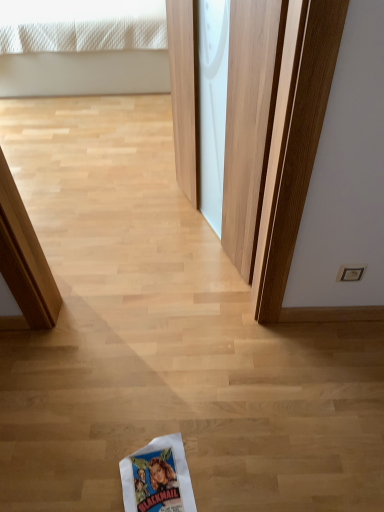
The image size is (384, 512). Identify the location of white fabric bed at upper left. (83, 47).

The image size is (384, 512). Describe the element at coordinates (83, 47) in the screenshot. I see `white fabric bed at upper left` at that location.

You are a GUI agent. You are given a task and a screenshot of the screen. Output one action in this format:
    pyautogui.click(x=<x>, y=<y>)
    Task: Click on the white fabric bed at upper left
    
    Given the screenshot: What is the action you would take?
    tap(83, 47)